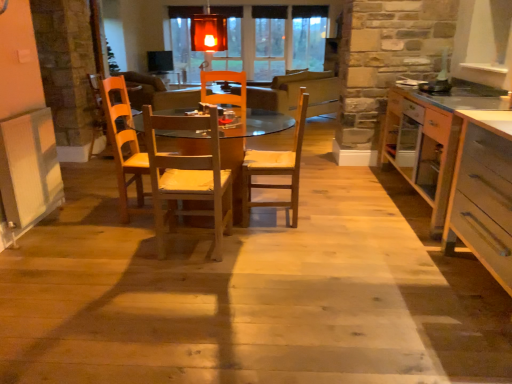
Question: Is light brown wooden chair at center, placed as the first chair when sorted from right to left, facing away from wooden chair at center, the 1th chair from the left?

Choices:
 (A) yes
 (B) no

Answer: (B)

Question: Can you confirm if light brown wooden chair at center, marked as the second chair in a left-to-right arrangement, is shorter than wooden chair at center, the second chair viewed from the right?

Choices:
 (A) yes
 (B) no

Answer: (B)

Question: Is light brown wooden chair at center, marked as the second chair in a left-to-right arrangement, not close to wooden chair at center, the 1th chair from the left?

Choices:
 (A) yes
 (B) no

Answer: (B)

Question: From a real-world perspective, does light brown wooden chair at center, marked as the second chair in a left-to-right arrangement, sit lower than wooden chair at center, the second chair viewed from the right?

Choices:
 (A) no
 (B) yes

Answer: (B)

Question: Does light brown wooden chair at center, marked as the second chair in a left-to-right arrangement, touch wooden chair at center, the 1th chair from the left?

Choices:
 (A) no
 (B) yes

Answer: (A)

Question: Considering the positions of point click(99, 107) and point click(246, 167), is point click(99, 107) closer or farther from the camera than point click(246, 167)?

Choices:
 (A) closer
 (B) farther

Answer: (B)

Question: Considering the positions of wooden armchair at left and light brown wooden chair at center, placed as the first chair when sorted from right to left, in the image, is wooden armchair at left wider or thinner than light brown wooden chair at center, placed as the first chair when sorted from right to left,?

Choices:
 (A) wide
 (B) thin

Answer: (A)

Question: Considering their positions, is wooden armchair at left located in front of or behind light brown wooden chair at center, placed as the first chair when sorted from right to left?

Choices:
 (A) behind
 (B) front

Answer: (A)

Question: Choose the correct answer: Is wooden armchair at left inside light brown wooden chair at center, marked as the second chair in a left-to-right arrangement, or outside it?

Choices:
 (A) outside
 (B) inside

Answer: (A)

Question: Relative to white laminate countertop at right, is wooden chair at center, the second chair viewed from the right, in front or behind?

Choices:
 (A) front
 (B) behind

Answer: (A)

Question: Is point (166, 208) closer or farther from the camera than point (409, 115)?

Choices:
 (A) closer
 (B) farther

Answer: (A)

Question: From a real-world perspective, is wooden chair at center, the 1th chair from the left, positioned above or below white laminate countertop at right?

Choices:
 (A) above
 (B) below

Answer: (A)

Question: Choose the correct answer: Is wooden chair at center, the 1th chair from the left, inside white laminate countertop at right or outside it?

Choices:
 (A) inside
 (B) outside

Answer: (B)

Question: Considering their positions, is wooden armchair at left located in front of or behind wooden chair at center, the second chair viewed from the right?

Choices:
 (A) front
 (B) behind

Answer: (B)

Question: Choose the correct answer: Is wooden armchair at left inside wooden chair at center, the second chair viewed from the right, or outside it?

Choices:
 (A) outside
 (B) inside

Answer: (A)